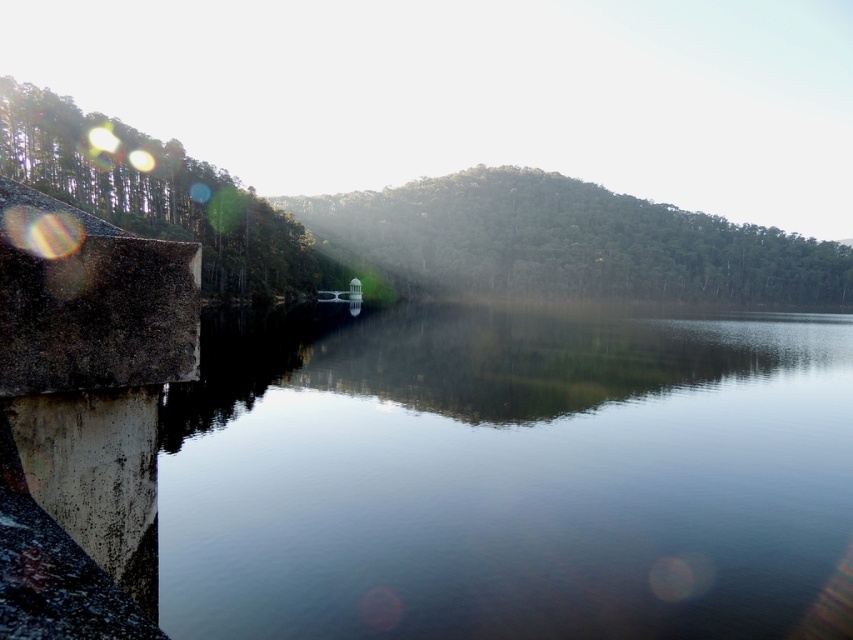
You are standing at the lakeside and notice the green textured hillside at center and the green matte trees at left. Which of these two objects is positioned higher in the scene?

The green textured hillside at center is positioned higher than the green matte trees at left in the scene.

Looking at this image, you are standing at the lakeside and want to walk from point A to point B. Point A is at coordinates point (457, 241) and point B is at coordinates point (180, 161). Which point is closer to you when you start walking?

Point B at point (180, 161) is closer to you because point A at point (457, 241) is further away from the camera, meaning it is farther from your current position.